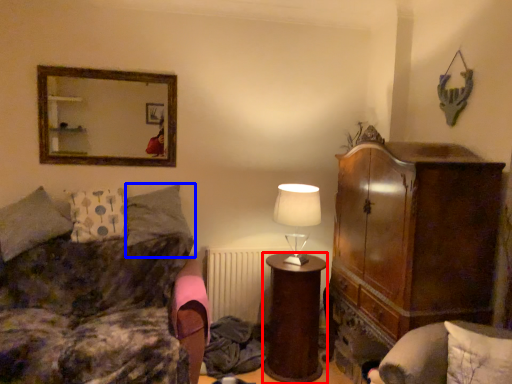
Question: Which object appears closest to the camera in this image, desk (highlighted by a red box) or pillow (highlighted by a blue box)?

Choices:
 (A) desk
 (B) pillow

Answer: (A)